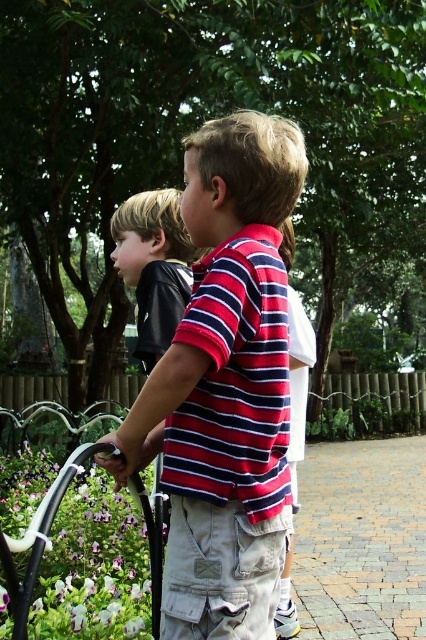
Question: Which point is farther from the camera taking this photo?

Choices:
 (A) (238, 323)
 (B) (14, 600)

Answer: (A)

Question: Can you confirm if striped cotton shirt at center is positioned below white plastic rail at lower left?

Choices:
 (A) no
 (B) yes

Answer: (A)

Question: Observing the image, what is the correct spatial positioning of striped cotton shirt at center in reference to white plastic rail at lower left?

Choices:
 (A) right
 (B) left

Answer: (A)

Question: Is striped cotton shirt at center to the right of white plastic rail at lower left from the viewer's perspective?

Choices:
 (A) no
 (B) yes

Answer: (B)